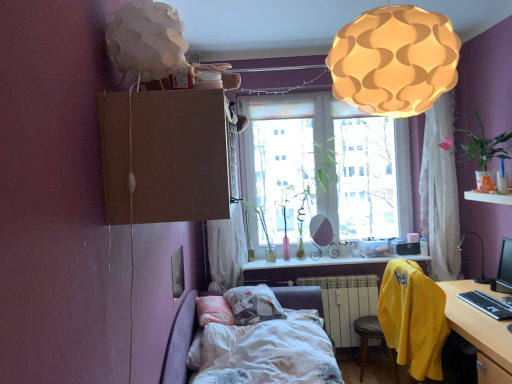
Question: Is black glossy monitor at right at the right side of clear glass vase at center, which is the 1th window sill from left to right?

Choices:
 (A) no
 (B) yes

Answer: (B)

Question: Does black glossy monitor at right have a lesser width compared to clear glass vase at center, acting as the 2th window sill starting from the front?

Choices:
 (A) no
 (B) yes

Answer: (B)

Question: Can you see black glossy monitor at right touching clear glass vase at center, which is the first window sill in bottom-to-top order?

Choices:
 (A) no
 (B) yes

Answer: (A)

Question: Is the depth of black glossy monitor at right greater than that of clear glass vase at center, the second window sill viewed from the top?

Choices:
 (A) yes
 (B) no

Answer: (B)

Question: Does black glossy monitor at right have a lesser height compared to clear glass vase at center, which appears as the 2th window sill when viewed from the right?

Choices:
 (A) no
 (B) yes

Answer: (A)

Question: Is black glossy monitor at right oriented away from clear glass vase at center, which is the 1th window sill from left to right?

Choices:
 (A) yes
 (B) no

Answer: (B)

Question: Is clear glass vase at center, acting as the 2th window sill starting from the front, beside black glossy monitor at right?

Choices:
 (A) no
 (B) yes

Answer: (A)

Question: Is clear glass vase at center, acting as the 2th window sill starting from the front, bigger than black glossy monitor at right?

Choices:
 (A) yes
 (B) no

Answer: (B)

Question: Is clear glass vase at center, acting as the 2th window sill starting from the front, facing towards black glossy monitor at right?

Choices:
 (A) no
 (B) yes

Answer: (A)

Question: Can you confirm if clear glass vase at center, which is the first window sill in bottom-to-top order, is positioned to the left of black glossy monitor at right?

Choices:
 (A) no
 (B) yes

Answer: (B)

Question: From a real-world perspective, is clear glass vase at center, which appears as the 2th window sill when viewed from the right, on black glossy monitor at right?

Choices:
 (A) yes
 (B) no

Answer: (B)

Question: Considering the relative sizes of clear glass vase at center, which appears as the 2th window sill when viewed from the right, and black glossy monitor at right in the image provided, is clear glass vase at center, which appears as the 2th window sill when viewed from the right, thinner than black glossy monitor at right?

Choices:
 (A) no
 (B) yes

Answer: (A)

Question: Is white cotton bed at center at the right side of white sheer curtain at upper right, which appears as the 1th curtain when viewed from the right?

Choices:
 (A) no
 (B) yes

Answer: (A)